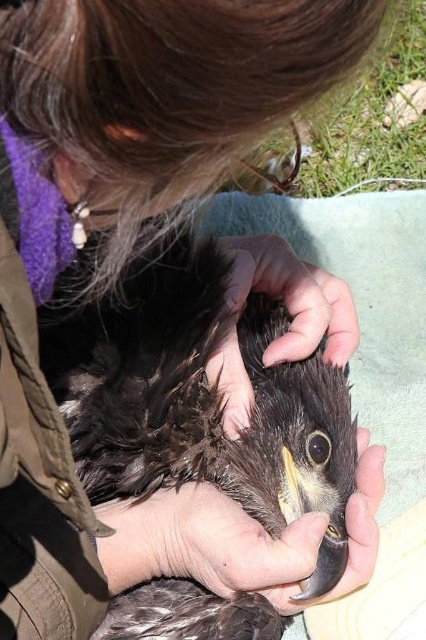
You are standing in the outdoor area with green grass and want to walk from the point at coordinates point (108, 392) to the point at coordinates point (245, 244). Which direction should you move relative to the person holding the bird?

You should move towards the direction away from the person holding the bird because point (108, 392) is in front of point (245, 244), meaning you need to go backward or behind the person to reach the second point.